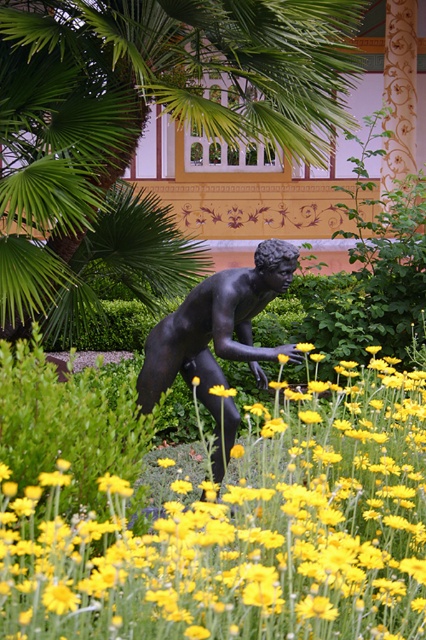
This screenshot has height=640, width=426. What do you see at coordinates (241, 532) in the screenshot?
I see `yellow matte flower at center` at bounding box center [241, 532].

Which is behind, point (391, 560) or point (216, 422)?

The point (216, 422) is more distant.

You are a GUI agent. You are given a task and a screenshot of the screen. Output one action in this format:
    pyautogui.click(x=<x>, y=<y>)
    Task: Click on the yellow matte flower at center
    
    Given the screenshot: What is the action you would take?
    pyautogui.click(x=241, y=532)

I want to click on yellow matte flower at center, so click(x=241, y=532).